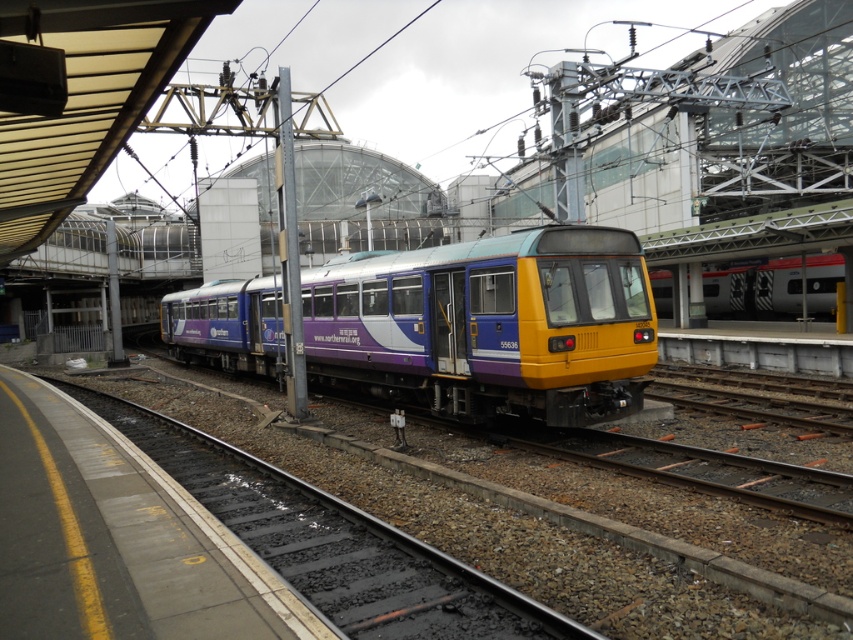
Is matte purple train at center to the right of red and white striped train at center from the viewer's perspective?

No, matte purple train at center is not to the right of red and white striped train at center.

Does matte purple train at center have a greater height compared to red and white striped train at center?

Correct, matte purple train at center is much taller as red and white striped train at center.

Between point (383, 342) and point (785, 305), which one is positioned behind?

Positioned behind is point (785, 305).

I want to click on matte purple train at center, so click(490, 324).

Does matte purple train at center appear over smooth concrete track at center?

Yes.

Measure the distance between matte purple train at center and camera.

They are 10.43 meters apart.

Describe the element at coordinates (490, 324) in the screenshot. I see `matte purple train at center` at that location.

Identify the location of matte purple train at center. (490, 324).

Is smooth concrete track at center further to the viewer compared to red and white striped train at center?

No, it is in front of red and white striped train at center.

Is point (213, 397) closer to viewer compared to point (824, 289)?

Yes.

Does point (561, 566) come behind point (795, 282)?

No, (561, 566) is closer to viewer.

Identify the location of smooth concrete track at center. (492, 531).